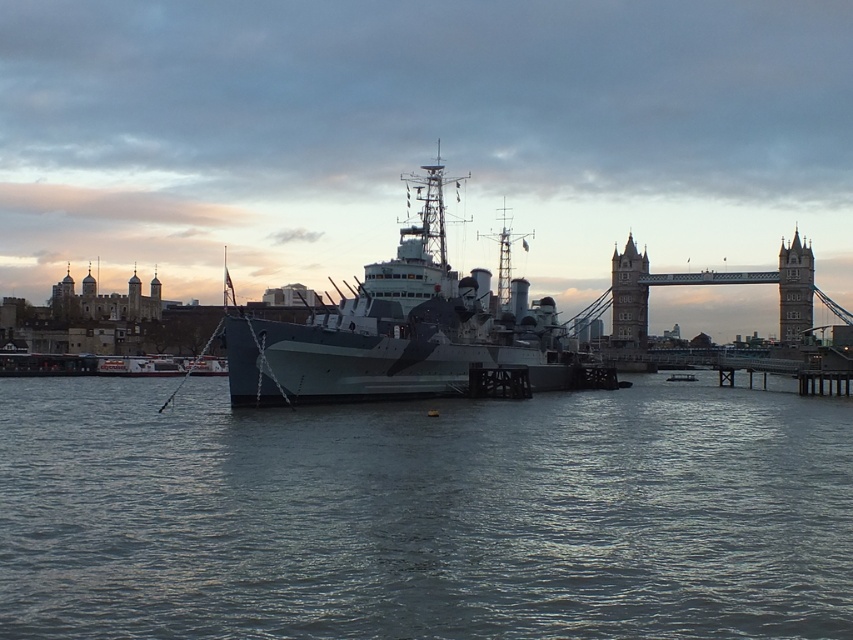
Between point (598, 308) and point (614, 289), which one is positioned behind?

Positioned behind is point (598, 308).

Is point (462, 372) closer to viewer compared to point (641, 333)?

Yes, it is.

Describe the element at coordinates (401, 330) in the screenshot. The height and width of the screenshot is (640, 853). I see `camouflage paint ship at center` at that location.

I want to click on camouflage paint ship at center, so click(x=401, y=330).

Is point (560, 470) behind point (642, 272)?

No.

This screenshot has height=640, width=853. What do you see at coordinates (424, 513) in the screenshot?
I see `gray water at center` at bounding box center [424, 513].

At what (x,y) coordinates should I click in order to perform the action: click on gray water at center. Please return your answer as a coordinate pair (x, y). Looking at the image, I should click on (424, 513).

Find the location of a particular element. The image size is (853, 640). camouflage paint ship at center is located at coordinates (401, 330).

Who is higher up, camouflage paint ship at center or stone tower at upper right?

camouflage paint ship at center is above.

What do you see at coordinates (401, 330) in the screenshot? I see `camouflage paint ship at center` at bounding box center [401, 330].

What are the coordinates of `camouflage paint ship at center` in the screenshot? It's located at (401, 330).